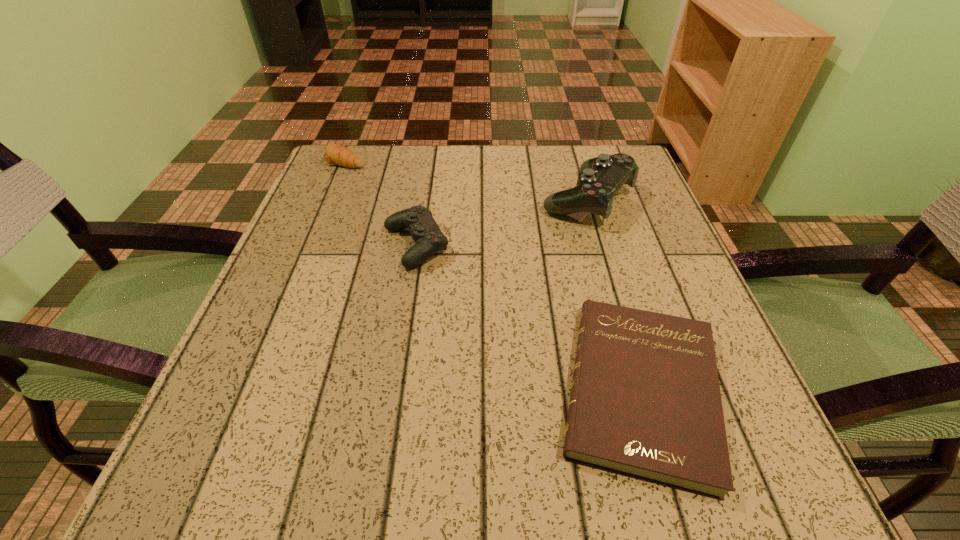
You are a GUI agent. You are given a task and a screenshot of the screen. Output one action in this format:
    pyautogui.click(x=<x>, y=<y>)
    Task: Click on the vacant region between the shorter control and the tallest object
    Image resolution: width=960 pixels, height=540 pixels.
    Given the screenshot: What is the action you would take?
    502,222

This screenshot has height=540, width=960. Find the location of `vacant region between the third object from right to left and the crescent roll`. vacant region between the third object from right to left and the crescent roll is located at coordinates (380, 202).

Where is `free space between the second object from left to right and the shortest object`? The image size is (960, 540). free space between the second object from left to right and the shortest object is located at coordinates (528, 318).

At what (x,y) coordinates should I click in order to perform the action: click on vacant area that lies between the third shortest object and the taller control. Please return your answer as a coordinate pair (x, y). The image size is (960, 540). Looking at the image, I should click on (502, 222).

At what (x,y) coordinates should I click in order to perform the action: click on empty space that is in between the third tallest object and the tallest object. Please return your answer as a coordinate pair (x, y). The image size is (960, 540). Looking at the image, I should click on (467, 179).

Image resolution: width=960 pixels, height=540 pixels. What are the coordinates of `free space between the third shortest object and the leftmost object` in the screenshot? It's located at (380, 202).

Identify the location of empty space between the crescent roll and the tallest object. [467, 179].

Identify the location of free space between the shortest object and the shorter control. The width and height of the screenshot is (960, 540). (528, 318).

Where is `the closest object to the tallest object`? The height and width of the screenshot is (540, 960). the closest object to the tallest object is located at coordinates (429, 239).

Where is `object that is the third closest to the hardback book`? The height and width of the screenshot is (540, 960). object that is the third closest to the hardback book is located at coordinates (336, 154).